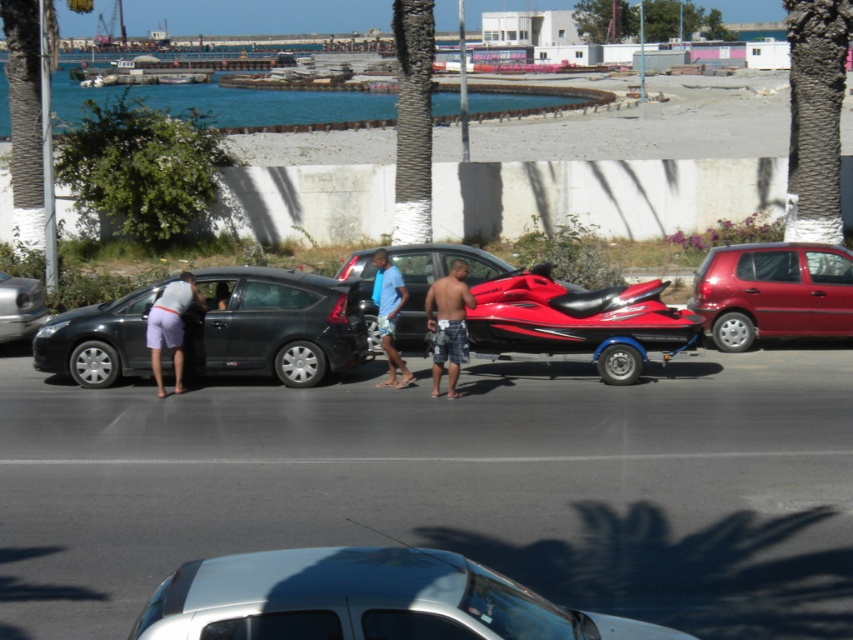
Between matte black car at left and shiny red jet ski at center, which one has more height?

With more height is matte black car at left.

Between matte black car at left and shiny red jet ski at center, which one is positioned higher?

shiny red jet ski at center

Which is in front, point (73, 365) or point (659, 298)?

Point (659, 298)

This screenshot has width=853, height=640. I want to click on matte black car at left, so click(273, 324).

Which is more to the left, matte black car at left or metallic red car at right?

matte black car at left is more to the left.

Can you confirm if matte black car at left is positioned to the right of metallic red car at right?

In fact, matte black car at left is to the left of metallic red car at right.

This screenshot has height=640, width=853. I want to click on matte black car at left, so click(x=273, y=324).

Which is above, shiny red jet ski at center or blue denim shorts at center?

shiny red jet ski at center

Based on the photo, between shiny red jet ski at center and blue denim shorts at center, which one is positioned lower?

blue denim shorts at center is lower down.

You are a GUI agent. You are given a task and a screenshot of the screen. Output one action in this format:
    pyautogui.click(x=<x>, y=<y>)
    Task: Click on the shiny red jet ski at center
    Image resolution: width=853 pixels, height=640 pixels.
    Given the screenshot: What is the action you would take?
    pyautogui.click(x=579, y=321)